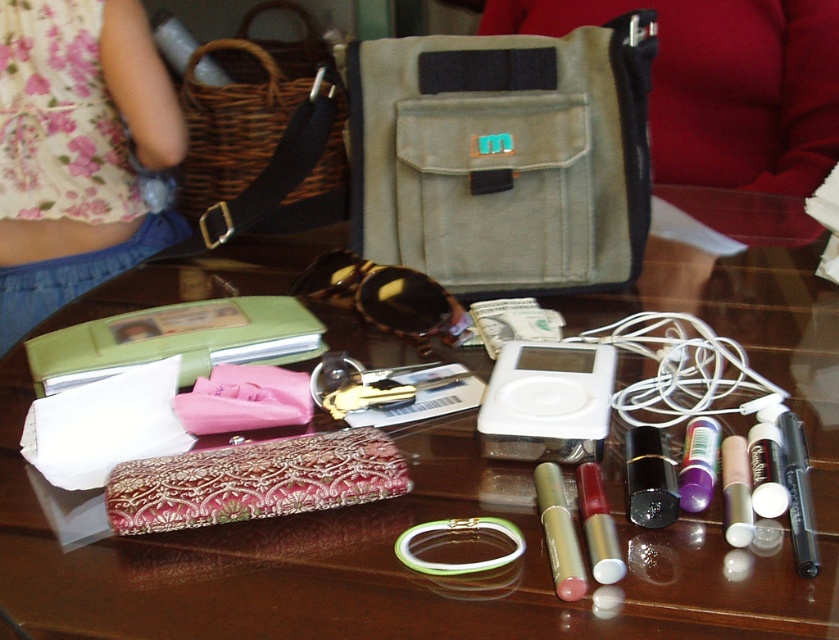
Describe the element at coordinates (503, 156) in the screenshot. I see `olive green canvas pouch at center` at that location.

Is point (644, 122) positioned behind point (107, 42)?

That is False.

Between point (360, 120) and point (103, 72), which one is positioned behind?

Point (103, 72)

You are a GUI agent. You are given a task and a screenshot of the screen. Output one action in this format:
    pyautogui.click(x=<x>, y=<y>)
    Task: Click on the olive green canvas pouch at center
    
    Given the screenshot: What is the action you would take?
    pyautogui.click(x=503, y=156)

Who is positioned more to the left, floral fabric dress at upper left or embroidered fabric pouch at center?

From the viewer's perspective, floral fabric dress at upper left appears more on the left side.

The width and height of the screenshot is (839, 640). What do you see at coordinates (77, 150) in the screenshot?
I see `floral fabric dress at upper left` at bounding box center [77, 150].

Between point (133, 188) and point (154, 531), which one is positioned in front?

Point (154, 531)

The image size is (839, 640). Find the location of `floral fabric dress at upper left`. floral fabric dress at upper left is located at coordinates (77, 150).

The height and width of the screenshot is (640, 839). I want to click on olive green canvas pouch at center, so click(503, 156).